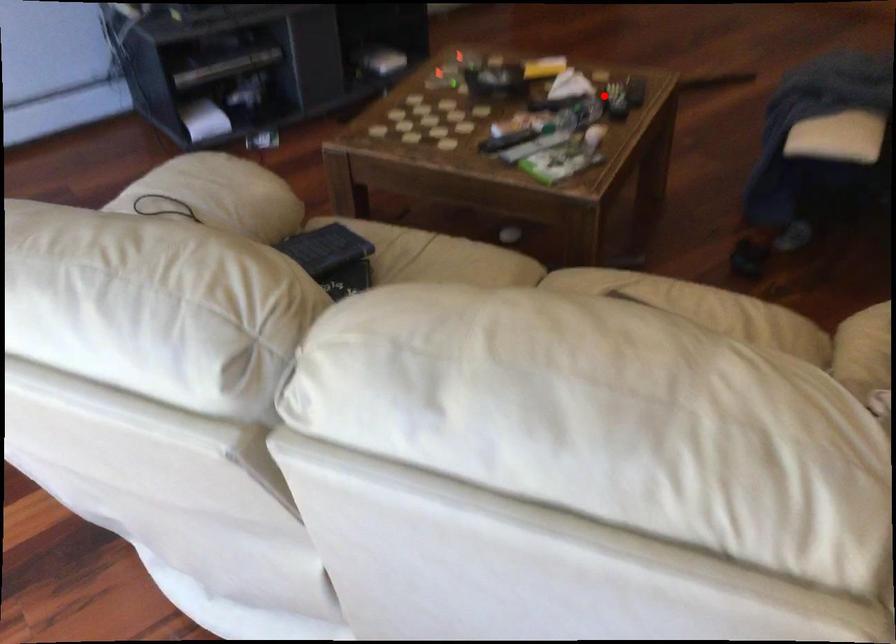
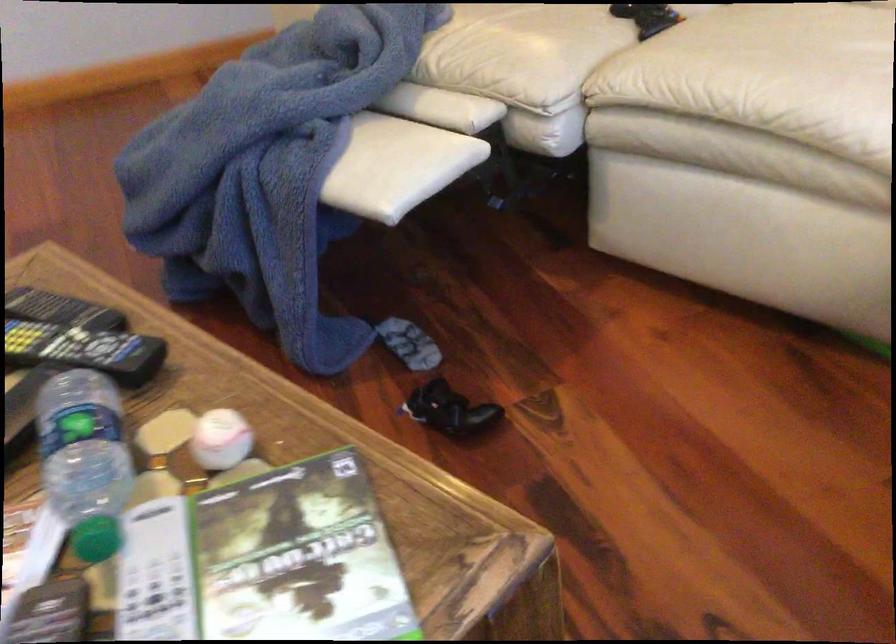
In the second image, find the point that corresponds to the highlighted location in the first image.

(84, 350)